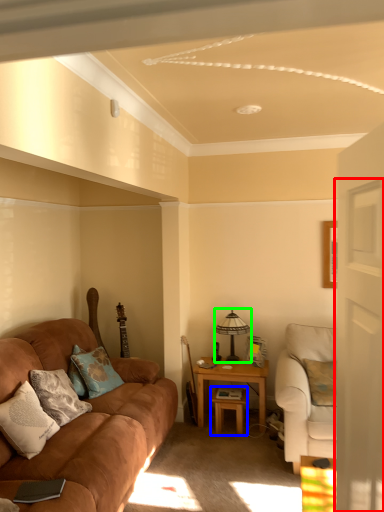
Question: Considering the real-world distances, which object is closest to glass door (highlighted by a red box)? table (highlighted by a blue box) or table lamp (highlighted by a green box).

Choices:
 (A) table
 (B) table lamp

Answer: (A)